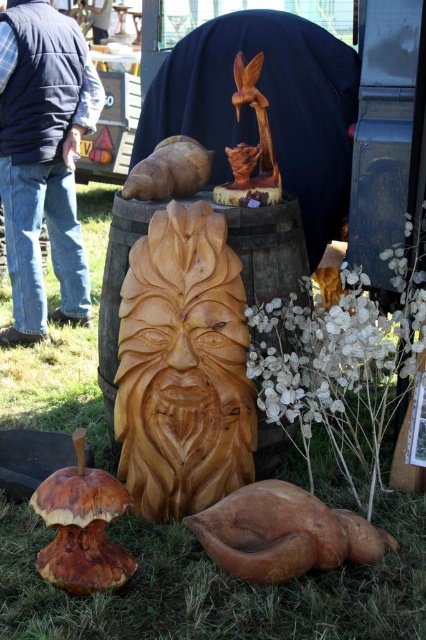
Question: Among these points, which one is nearest to the camera?

Choices:
 (A) (158, 148)
 (B) (157, 352)
 (C) (219, 202)
 (D) (425, 426)

Answer: (B)

Question: Among these objects, which one is nearest to the camera?

Choices:
 (A) brown wood snail at upper center
 (B) white matte flowers at center right

Answer: (B)

Question: Where is white matte flowers at center right located in relation to wooden bird at upper center in the image?

Choices:
 (A) right
 (B) left

Answer: (A)

Question: Which point is farther to the camera?

Choices:
 (A) (325, 541)
 (B) (264, 120)
 (C) (311, 333)
 (D) (150, 624)

Answer: (B)

Question: Is wooden duck at lower center above wooden bird at upper center?

Choices:
 (A) no
 (B) yes

Answer: (A)

Question: Is green matte wood carving at center positioned behind wooden carving at center?

Choices:
 (A) yes
 (B) no

Answer: (B)